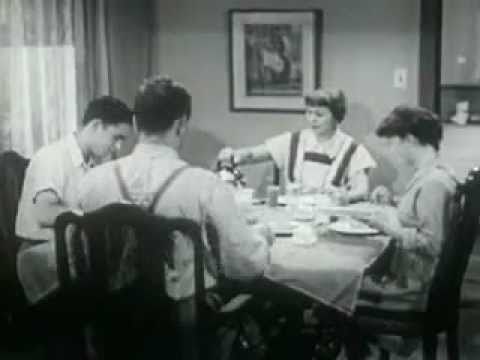
This screenshot has height=360, width=480. I want to click on light switch, so click(400, 80).